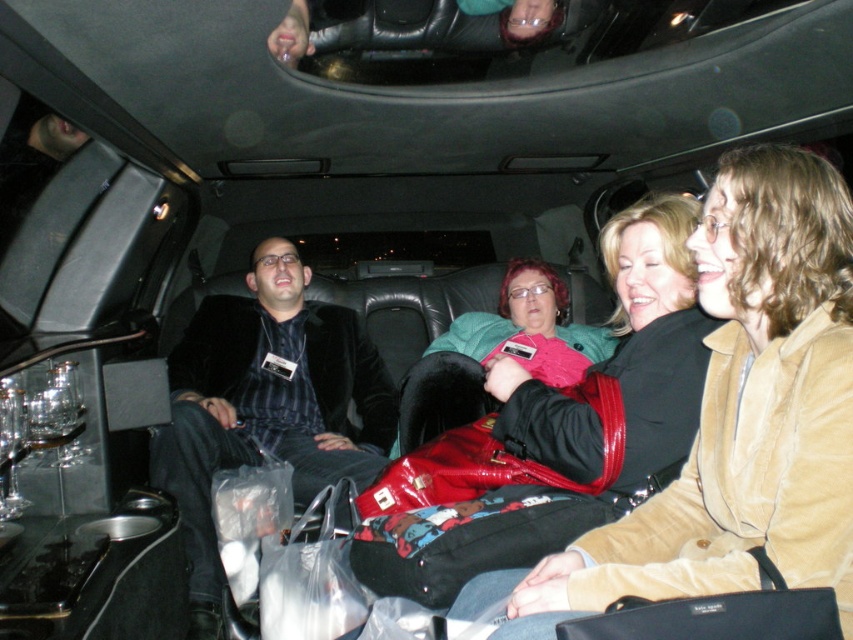
Does point (523, 560) lie in front of point (317, 438)?

That is True.

Identify the location of shiny red purse at center. This screenshot has height=640, width=853. tap(567, 426).

Measure the distance between shiny red purse at center and camera.

shiny red purse at center and camera are 1.62 meters apart.

The height and width of the screenshot is (640, 853). I want to click on shiny red purse at center, so click(567, 426).

Does velvet brown jacket at center have a lesser width compared to shiny red purse at center?

Yes, velvet brown jacket at center is thinner than shiny red purse at center.

Measure the distance between velvet brown jacket at center and camera.

The distance of velvet brown jacket at center from camera is 3.59 feet.

This screenshot has height=640, width=853. What do you see at coordinates (741, 412) in the screenshot?
I see `velvet brown jacket at center` at bounding box center [741, 412].

This screenshot has width=853, height=640. I want to click on velvet brown jacket at center, so click(x=741, y=412).

Does velvet brown jacket at center have a lesser width compared to velvet black jacket at center?

Correct, velvet brown jacket at center's width is less than velvet black jacket at center's.

Is point (792, 573) closer to camera compared to point (299, 288)?

That is True.

Is point (817, 221) closer to camera compared to point (308, 390)?

That is True.

Locate an element on the screen. velvet brown jacket at center is located at coordinates (741, 412).